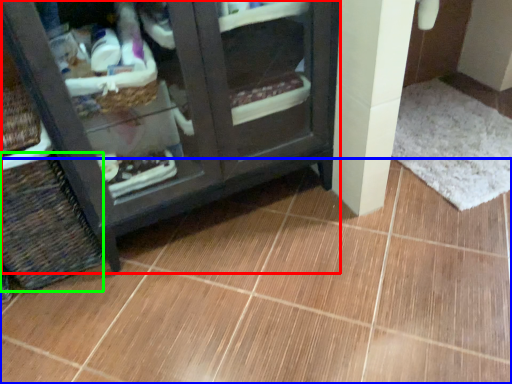
Question: Which object is the closest to the furniture (highlighted by a red box)? Choose among these: ceramic tile (highlighted by a blue box) or basket (highlighted by a green box).

Choices:
 (A) ceramic tile
 (B) basket

Answer: (B)